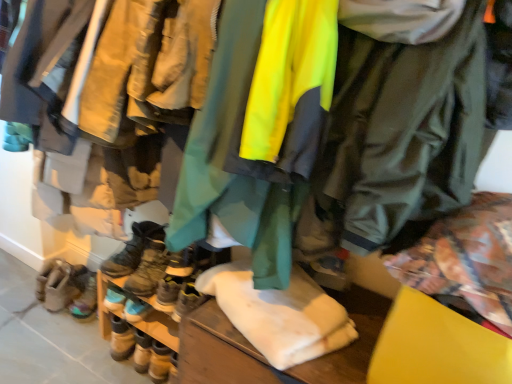
What do you see at coordinates (132, 249) in the screenshot? The image size is (512, 384). I see `leather boots at lower left, which ranks as the third footwear in right-to-left order` at bounding box center [132, 249].

What do you see at coordinates (259, 130) in the screenshot? I see `neon green waterproof jacket at center, the 1th jacket when ordered from left to right` at bounding box center [259, 130].

Where is `green matte jacket at center, the 2th jacket viewed from the left`? This screenshot has width=512, height=384. green matte jacket at center, the 2th jacket viewed from the left is located at coordinates (397, 123).

What do you see at coordinates (86, 299) in the screenshot?
I see `multicolored suede boots at lower left, which ranks as the fourth footwear in right-to-left order` at bounding box center [86, 299].

Locate an element on the screen. Image resolution: width=512 pixels, height=384 pixels. leather boots at lower left, which ranks as the third footwear in right-to-left order is located at coordinates [x=132, y=249].

From the image's perspective, which is above, multicolored suede boots at lower left, which ranks as the fourth footwear in right-to-left order, or neon green waterproof jacket at center, placed as the 2th jacket when sorted from right to left?

neon green waterproof jacket at center, placed as the 2th jacket when sorted from right to left.

How different are the orientations of multicolored suede boots at lower left, which is counted as the second footwear, starting from the left, and neon green waterproof jacket at center, the 1th jacket when ordered from left to right, in degrees?

The angle between the facing direction of multicolored suede boots at lower left, which is counted as the second footwear, starting from the left, and the facing direction of neon green waterproof jacket at center, the 1th jacket when ordered from left to right, is 8.03 degrees.

Are multicolored suede boots at lower left, which ranks as the fourth footwear in right-to-left order, and neon green waterproof jacket at center, placed as the 2th jacket when sorted from right to left, located far from each other?

Yes, multicolored suede boots at lower left, which ranks as the fourth footwear in right-to-left order, is far from neon green waterproof jacket at center, placed as the 2th jacket when sorted from right to left.

Looking at this image, how distant is multicolored suede boots at lower left, which ranks as the fourth footwear in right-to-left order, from neon green waterproof jacket at center, placed as the 2th jacket when sorted from right to left?

multicolored suede boots at lower left, which ranks as the fourth footwear in right-to-left order, and neon green waterproof jacket at center, placed as the 2th jacket when sorted from right to left, are 4.29 feet apart.

From the image's perspective, which object appears higher, leather boots at center, the 1th footwear in the right-to-left sequence, or green matte jacket at center, the 2th jacket viewed from the left?

green matte jacket at center, the 2th jacket viewed from the left, is shown above in the image.

Which is correct: leather boots at center, acting as the 5th footwear starting from the left, is inside green matte jacket at center, the 2th jacket viewed from the left, or outside of it?

leather boots at center, acting as the 5th footwear starting from the left, cannot be found inside green matte jacket at center, the 2th jacket viewed from the left.

From a real-world perspective, who is located higher, leather boots at center, the 1th footwear in the right-to-left sequence, or green matte jacket at center, the 2th jacket viewed from the left?

green matte jacket at center, the 2th jacket viewed from the left, from a real-world perspective.

Looking at the image, does leather boots at lower left, acting as the 2th footwear starting from the right, seem bigger or smaller compared to neon green waterproof jacket at center, placed as the 2th jacket when sorted from right to left?

In the image, leather boots at lower left, acting as the 2th footwear starting from the right, appears to be smaller than neon green waterproof jacket at center, placed as the 2th jacket when sorted from right to left.

From the image's perspective, which is above, leather boots at lower left, acting as the 2th footwear starting from the right, or neon green waterproof jacket at center, placed as the 2th jacket when sorted from right to left?

neon green waterproof jacket at center, placed as the 2th jacket when sorted from right to left.

How many degrees apart are the facing directions of leather boots at lower left, acting as the 2th footwear starting from the right, and neon green waterproof jacket at center, placed as the 2th jacket when sorted from right to left?

6.51 degrees.

Does point (134, 331) appear closer or farther from the camera than point (296, 190)?

Clearly, point (134, 331) is more distant from the camera than point (296, 190).

From a real-world perspective, which is physically above, leather boots at center, acting as the 5th footwear starting from the left, or multicolored suede boots at lower left, which ranks as the fourth footwear in right-to-left order?

leather boots at center, acting as the 5th footwear starting from the left, from a real-world perspective.

From the image's perspective, is leather boots at center, acting as the 5th footwear starting from the left, above or below multicolored suede boots at lower left, which ranks as the fourth footwear in right-to-left order?

From the image's perspective, leather boots at center, acting as the 5th footwear starting from the left, appears above multicolored suede boots at lower left, which ranks as the fourth footwear in right-to-left order.

Is leather boots at center, the 1th footwear in the right-to-left sequence, inside or outside of multicolored suede boots at lower left, which ranks as the fourth footwear in right-to-left order?

leather boots at center, the 1th footwear in the right-to-left sequence, is not inside multicolored suede boots at lower left, which ranks as the fourth footwear in right-to-left order, it's outside.

Considering the points (153, 247) and (92, 306), which point is in front, point (153, 247) or point (92, 306)?

Positioned in front is point (153, 247).

Is leather boots at lower left, which ranks as the 3th footwear in left-to-right order, outside of neon green waterproof jacket at center, the 1th jacket when ordered from left to right?

Yes, leather boots at lower left, which ranks as the 3th footwear in left-to-right order, is not within neon green waterproof jacket at center, the 1th jacket when ordered from left to right.

Which of these two, leather boots at lower left, which ranks as the third footwear in right-to-left order, or neon green waterproof jacket at center, the 1th jacket when ordered from left to right, is smaller?

leather boots at lower left, which ranks as the third footwear in right-to-left order, is smaller.

Which object is positioned more to the right, leather boots at lower left, which ranks as the third footwear in right-to-left order, or neon green waterproof jacket at center, placed as the 2th jacket when sorted from right to left?

neon green waterproof jacket at center, placed as the 2th jacket when sorted from right to left.

Considering the sizes of leather boots at lower left, which ranks as the third footwear in right-to-left order, and neon green waterproof jacket at center, the 1th jacket when ordered from left to right, in the image, is leather boots at lower left, which ranks as the third footwear in right-to-left order, wider or thinner than neon green waterproof jacket at center, the 1th jacket when ordered from left to right,?

Considering their sizes, leather boots at lower left, which ranks as the third footwear in right-to-left order, looks slimmer than neon green waterproof jacket at center, the 1th jacket when ordered from left to right.

Can you tell me how much multicolored suede boots at lower left, which is counted as the second footwear, starting from the left, and leather boots at lower left, which ranks as the third footwear in right-to-left order, differ in facing direction?

19 degrees.

Could leather boots at lower left, which ranks as the 3th footwear in left-to-right order, be considered to be inside multicolored suede boots at lower left, which is counted as the second footwear, starting from the left?

No, leather boots at lower left, which ranks as the 3th footwear in left-to-right order, is not inside multicolored suede boots at lower left, which is counted as the second footwear, starting from the left.

In the scene shown: Which point is more forward, (94, 303) or (123, 257)?

Point (123, 257)

Which point is more forward, [121,356] or [73,316]?

Point [121,356]

Is leather boots at lower left, the 4th footwear positioned from the left, wider than multicolored suede boots at lower left, which ranks as the fourth footwear in right-to-left order?

No.

Is leather boots at lower left, acting as the 2th footwear starting from the right, looking in the opposite direction of multicolored suede boots at lower left, which is counted as the second footwear, starting from the left?

No, leather boots at lower left, acting as the 2th footwear starting from the right, is not facing the opposite direction of multicolored suede boots at lower left, which is counted as the second footwear, starting from the left.

Locate an element on the screen. This screenshot has width=512, height=384. footwear that is the 2nd one when counting leftward from the leather boots at lower left, acting as the 2th footwear starting from the right is located at coordinates (86, 299).

Where is `the 4th footwear to the left of the neon green waterproof jacket at center, the 1th jacket when ordered from left to right, starting your count from the anchor`? This screenshot has height=384, width=512. the 4th footwear to the left of the neon green waterproof jacket at center, the 1th jacket when ordered from left to right, starting your count from the anchor is located at coordinates (86, 299).

Locate an element on the screen. The height and width of the screenshot is (384, 512). footwear that is the 1st object located behind the green matte jacket at center, the 2th jacket viewed from the left is located at coordinates (148, 261).

When comparing their distances from neon green waterproof jacket at center, the 1th jacket when ordered from left to right, does green matte jacket at center, the 1th jacket in the right-to-left sequence, or leather boots at center, the 1th footwear in the right-to-left sequence, seem further?

Based on the image, leather boots at center, the 1th footwear in the right-to-left sequence, appears to be further to neon green waterproof jacket at center, the 1th jacket when ordered from left to right.

Estimate the real-world distances between objects in this image. Which object is closer to leather boots at lower left, placed as the 1th footwear when sorted from left to right, multicolored suede boots at lower left, which ranks as the fourth footwear in right-to-left order, or leather boots at lower left, which ranks as the 3th footwear in left-to-right order?

multicolored suede boots at lower left, which ranks as the fourth footwear in right-to-left order, is closer to leather boots at lower left, placed as the 1th footwear when sorted from left to right.

Based on their spatial positions, is neon green waterproof jacket at center, the 1th jacket when ordered from left to right, or leather boots at center, the 1th footwear in the right-to-left sequence, closer to green matte jacket at center, the 1th jacket in the right-to-left sequence?

neon green waterproof jacket at center, the 1th jacket when ordered from left to right, lies closer to green matte jacket at center, the 1th jacket in the right-to-left sequence, than the other object.

Based on their spatial positions, is leather boots at lower left, acting as the 2th footwear starting from the right, or leather boots at center, acting as the 5th footwear starting from the left, further from multicolored suede boots at lower left, which is counted as the second footwear, starting from the left?

leather boots at center, acting as the 5th footwear starting from the left, lies further to multicolored suede boots at lower left, which is counted as the second footwear, starting from the left, than the other object.

Based on the photo, when comparing their distances from neon green waterproof jacket at center, placed as the 2th jacket when sorted from right to left, does leather boots at lower left, the 5th footwear when ordered from right to left, or multicolored suede boots at lower left, which ranks as the fourth footwear in right-to-left order, seem closer?

Among the two, leather boots at lower left, the 5th footwear when ordered from right to left, is located nearer to neon green waterproof jacket at center, placed as the 2th jacket when sorted from right to left.

When comparing their distances from neon green waterproof jacket at center, the 1th jacket when ordered from left to right, does green matte jacket at center, the 1th jacket in the right-to-left sequence, or leather boots at lower left, the 5th footwear when ordered from right to left, seem closer?

Among the two, green matte jacket at center, the 1th jacket in the right-to-left sequence, is located nearer to neon green waterproof jacket at center, the 1th jacket when ordered from left to right.

Based on their spatial positions, is leather boots at lower left, which ranks as the third footwear in right-to-left order, or green matte jacket at center, the 2th jacket viewed from the left, further from leather boots at lower left, the 5th footwear when ordered from right to left?

green matte jacket at center, the 2th jacket viewed from the left, is further to leather boots at lower left, the 5th footwear when ordered from right to left.

Consider the image. From the image, which object appears to be farther from leather boots at lower left, acting as the 2th footwear starting from the right, neon green waterproof jacket at center, placed as the 2th jacket when sorted from right to left, or multicolored suede boots at lower left, which is counted as the second footwear, starting from the left?

Based on the image, neon green waterproof jacket at center, placed as the 2th jacket when sorted from right to left, appears to be further to leather boots at lower left, acting as the 2th footwear starting from the right.

Identify the location of jacket positioned between green matte jacket at center, the 2th jacket viewed from the left, and leather boots at lower left, placed as the 1th footwear when sorted from left to right, from near to far. The width and height of the screenshot is (512, 384). (259, 130).

Locate an element on the screen. footwear located between neon green waterproof jacket at center, the 1th jacket when ordered from left to right, and leather boots at lower left, which ranks as the third footwear in right-to-left order, in the depth direction is located at coordinates (148, 261).

Locate an element on the screen. The height and width of the screenshot is (384, 512). footwear between leather boots at lower left, placed as the 1th footwear when sorted from left to right, and leather boots at lower left, which ranks as the third footwear in right-to-left order is located at coordinates (86, 299).

I want to click on jacket between green matte jacket at center, the 2th jacket viewed from the left, and leather boots at lower left, acting as the 2th footwear starting from the right, along the z-axis, so click(259, 130).